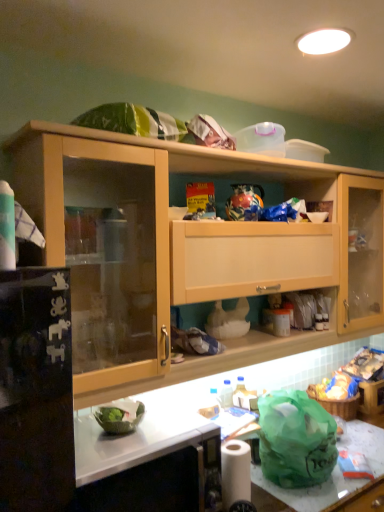
Question: In terms of size, does white matte toilet paper at lower center appear bigger or smaller than white glossy countertop at lower center, positioned as the second counter top in right-to-left order?

Choices:
 (A) small
 (B) big

Answer: (A)

Question: From a real-world perspective, is white matte toilet paper at lower center above or below white glossy countertop at lower center, placed as the first counter top when sorted from top to bottom?

Choices:
 (A) above
 (B) below

Answer: (B)

Question: Which of these objects is positioned farthest from the white marble countertop at lower center?

Choices:
 (A) green plastic bag at lower right, the second counter top positioned from the top
 (B) white matte toilet paper at lower center
 (C) white glossy countertop at lower center, which ranks as the first counter top in left-to-right order

Answer: (A)

Question: Considering the real-world distances, which object is closest to the green plastic bag at lower right, positioned as the first counter top in right-to-left order?

Choices:
 (A) white glossy countertop at lower center, arranged as the second counter top when ordered from the bottom
 (B) white matte toilet paper at lower center
 (C) white marble countertop at lower center

Answer: (B)